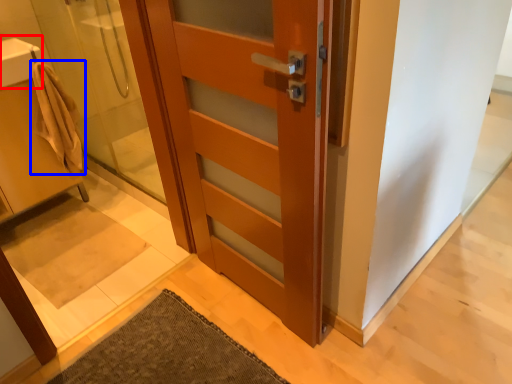
Question: Which object is closer to the camera taking this photo, sink (highlighted by a red box) or bathrobe (highlighted by a blue box)?

Choices:
 (A) sink
 (B) bathrobe

Answer: (A)